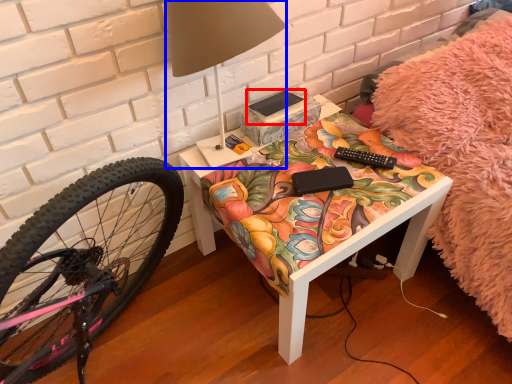
Question: Which object is closer to the camera taking this photo, book (highlighted by a red box) or table lamp (highlighted by a blue box)?

Choices:
 (A) book
 (B) table lamp

Answer: (B)